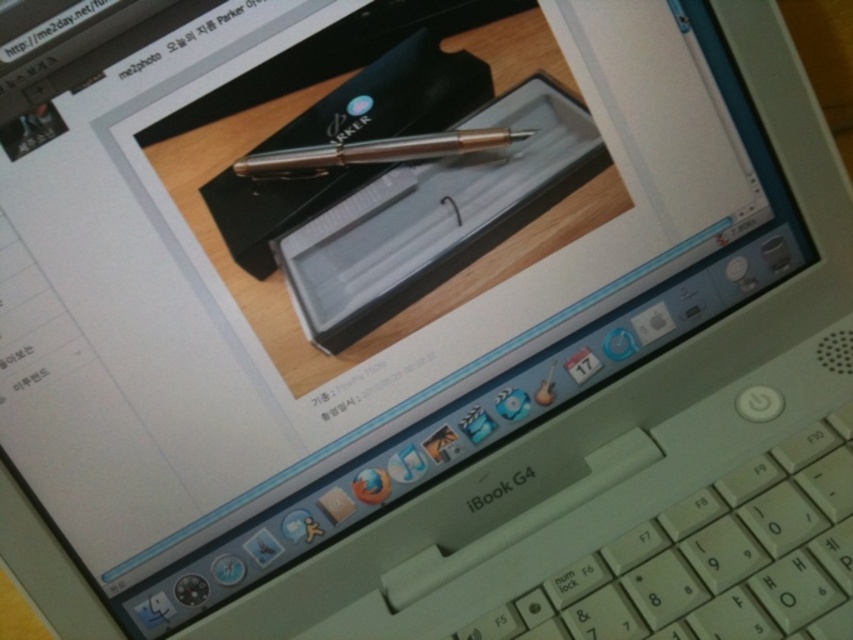
Can you confirm if white plastic keyboard at lower right is positioned to the right of gold metallic pen at center?

Yes, white plastic keyboard at lower right is to the right of gold metallic pen at center.

Which is below, white plastic keyboard at lower right or gold metallic pen at center?

white plastic keyboard at lower right is lower down.

Between point (582, 611) and point (383, 150), which one is positioned in front?

Point (582, 611)

Where is `white plastic keyboard at lower right`? The height and width of the screenshot is (640, 853). white plastic keyboard at lower right is located at coordinates (712, 557).